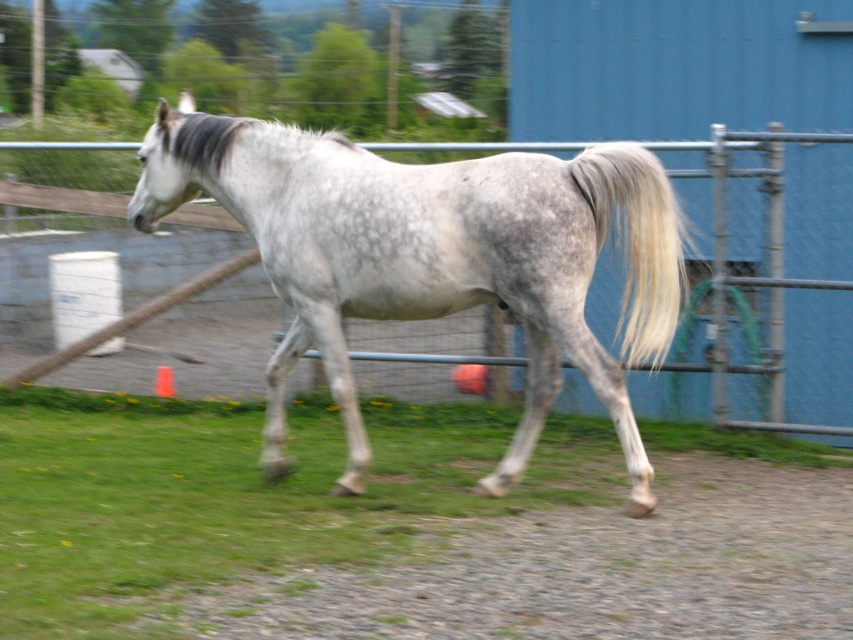
Question: Does gray speckled horse at center have a larger size compared to gray silky tail at right?

Choices:
 (A) yes
 (B) no

Answer: (A)

Question: Which of the following is the farthest from the observer?

Choices:
 (A) gray speckled horse at center
 (B) green grass at lower center
 (C) gray silky tail at right

Answer: (B)

Question: Does green grass at lower center have a larger size compared to gray speckled horse at center?

Choices:
 (A) yes
 (B) no

Answer: (B)

Question: Estimate the real-world distances between objects in this image. Which object is closer to the green grass at lower center?

Choices:
 (A) gray silky tail at right
 (B) gray speckled horse at center

Answer: (B)

Question: Is gray speckled horse at center positioned behind gray silky tail at right?

Choices:
 (A) yes
 (B) no

Answer: (B)

Question: Which object is farther from the camera taking this photo?

Choices:
 (A) green grass at lower center
 (B) gray silky tail at right
 (C) gray speckled horse at center

Answer: (A)